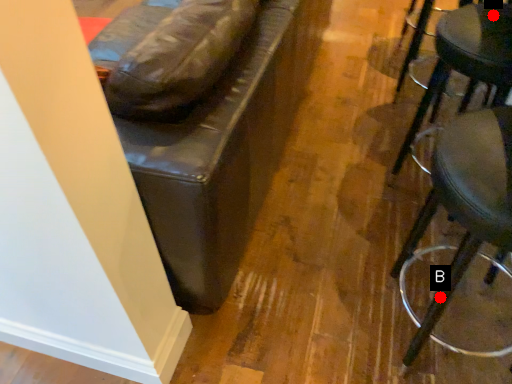
Question: Two points are circled on the image, labeled by A and B beside each circle. Among these points, which one is nearest to the camera?

Choices:
 (A) A is closer
 (B) B is closer

Answer: (B)